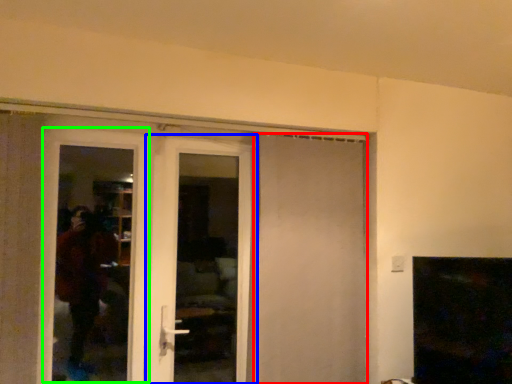
Question: Which object is positioned closest to door (highlighted by a red box)? Select from door (highlighted by a blue box) and screen door (highlighted by a green box).

Choices:
 (A) door
 (B) screen door

Answer: (A)